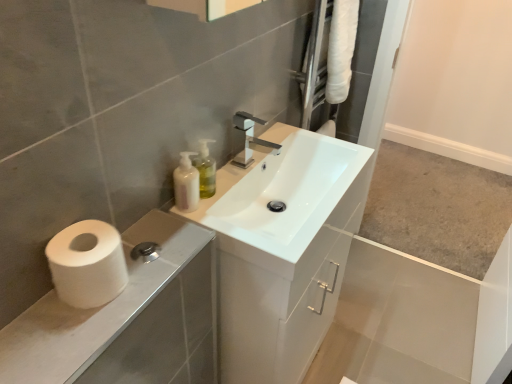
Question: Is white glossy cabinet at lower left at the right side of white matte pump bottle at upper center?

Choices:
 (A) no
 (B) yes

Answer: (A)

Question: Is the position of white glossy cabinet at lower left less distant than that of white matte pump bottle at upper center?

Choices:
 (A) yes
 (B) no

Answer: (A)

Question: Is white matte pump bottle at upper center inside white glossy cabinet at lower left?

Choices:
 (A) no
 (B) yes

Answer: (A)

Question: Would you say white glossy cabinet at lower left is outside white matte pump bottle at upper center?

Choices:
 (A) yes
 (B) no

Answer: (A)

Question: Is white glossy cabinet at lower left far from white matte pump bottle at upper center?

Choices:
 (A) no
 (B) yes

Answer: (A)

Question: Considering the positions of point (311, 160) and point (182, 152), is point (311, 160) closer or farther from the camera than point (182, 152)?

Choices:
 (A) closer
 (B) farther

Answer: (B)

Question: Considering the positions of white glossy sink at center and white matte pump bottle at upper center in the image, is white glossy sink at center taller or shorter than white matte pump bottle at upper center?

Choices:
 (A) tall
 (B) short

Answer: (A)

Question: Is white glossy sink at center to the left or to the right of white matte pump bottle at upper center in the image?

Choices:
 (A) right
 (B) left

Answer: (A)

Question: From a real-world perspective, is white glossy sink at center above or below white matte pump bottle at upper center?

Choices:
 (A) above
 (B) below

Answer: (B)

Question: Considering the positions of translucent plastic soap dispenser at upper center and white glossy cabinet at lower left in the image, is translucent plastic soap dispenser at upper center bigger or smaller than white glossy cabinet at lower left?

Choices:
 (A) big
 (B) small

Answer: (B)

Question: Considering the relative positions of translucent plastic soap dispenser at upper center and white glossy cabinet at lower left in the image provided, is translucent plastic soap dispenser at upper center to the left or to the right of white glossy cabinet at lower left?

Choices:
 (A) right
 (B) left

Answer: (A)

Question: From the image's perspective, is translucent plastic soap dispenser at upper center positioned above or below white glossy cabinet at lower left?

Choices:
 (A) below
 (B) above

Answer: (B)

Question: Is translucent plastic soap dispenser at upper center inside or outside of white glossy cabinet at lower left?

Choices:
 (A) inside
 (B) outside

Answer: (B)

Question: Do you think white glossy sink at center is within white matte toilet paper at lower left, or outside of it?

Choices:
 (A) outside
 (B) inside

Answer: (A)

Question: Is white glossy sink at center taller or shorter than white matte toilet paper at lower left?

Choices:
 (A) short
 (B) tall

Answer: (B)